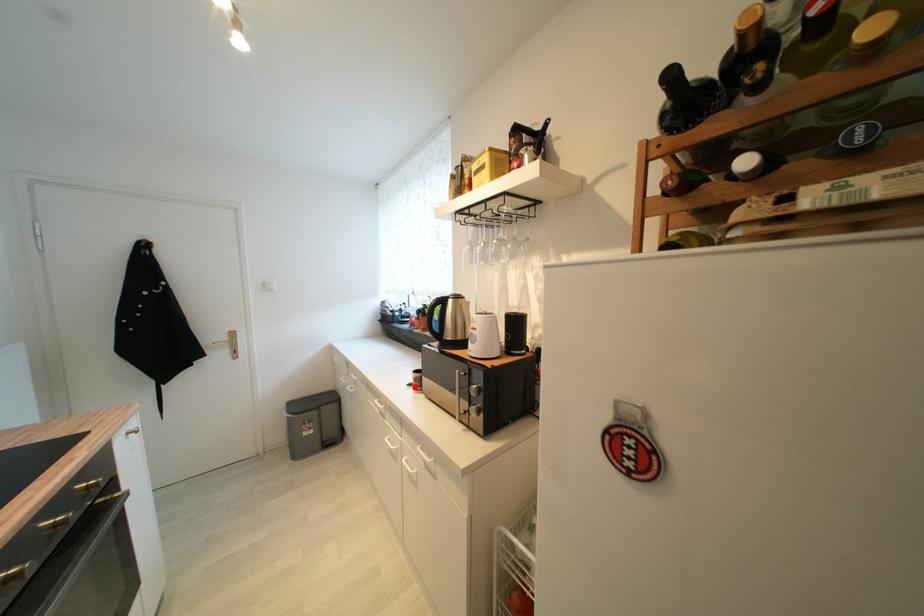
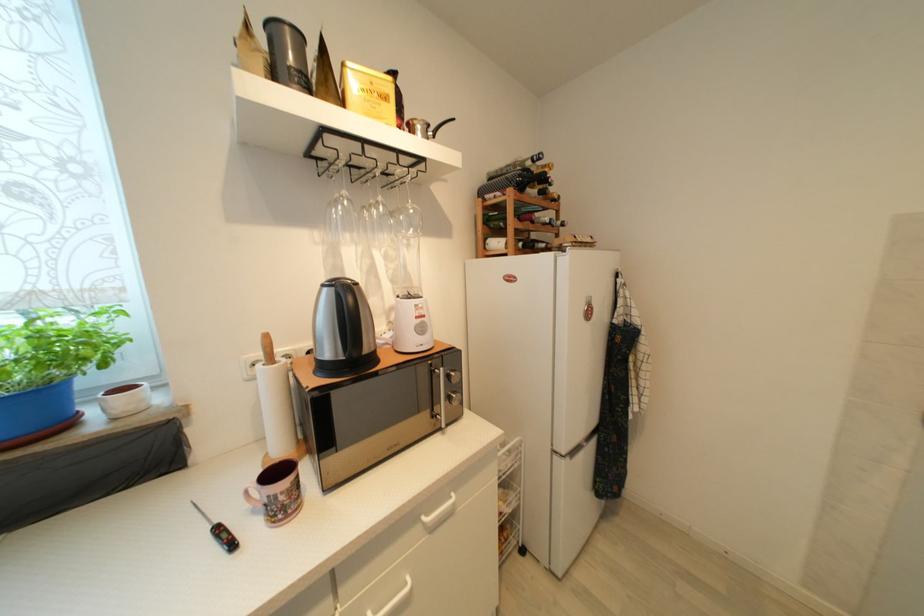
Question: I am providing you with two images of the same scene from different viewpoints. A red point is shown in image1. For the corresponding object point in image2, is it positioned nearer or farther from the camera?

Choices:
 (A) Nearer
 (B) Farther

Answer: (A)